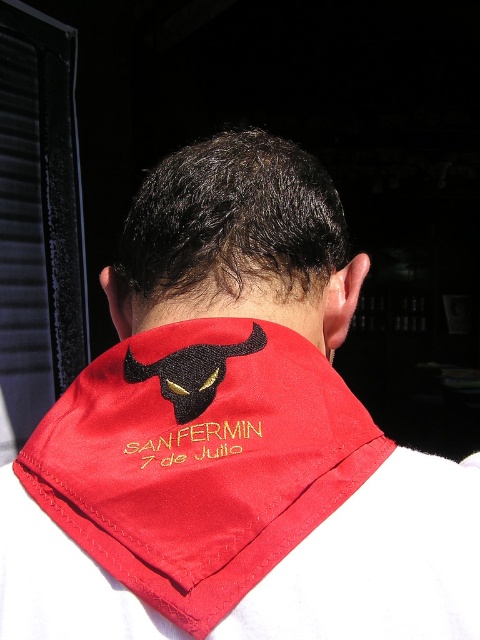
You are a photographer setting up a shoot with two red satin accessories. You have a red satin neckband at back and a red satin bandana at center. Based on the scene, which accessory is taller when viewed from behind?

The red satin bandana at center is taller than the red satin neckband at back.

You are a photographer wanting to capture the red satin neckband at back and the yellow embroidered text at center in a single frame. Given that the camera can only focus on one object at a time, which object should you focus on to ensure the other remains in the background?

The red satin neckband at back is bigger than the yellow embroidered text at center, so focusing on the red satin neckband at back will keep the smaller yellow embroidered text at center in the background.